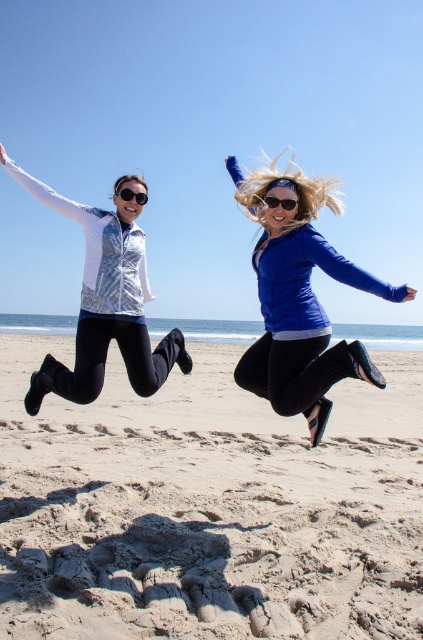
You are a photographer trying to capture the perfect shot of the sandy beach at lower center and the white textured vest at left. Since you want to emphasize the vastness of the beach, which object should you focus on and why?

You should focus on the sandy beach at lower center because it is larger in size than the white textured vest at left, making it better suited to emphasize the vastness of the beach.

Based on the coordinates provided in the image, where is the sandy beach at lower center located?

The sandy beach at lower center is located at point [208,508] in the image.

You are a photographer trying to capture a photo of the white textured vest at left and the black plastic goggles at upper center. Which object should you focus on first if you want to ensure both are in the frame without moving the camera?

The white textured vest at left is located below the black plastic goggles at upper center, so you should focus on the black plastic goggles at upper center first to ensure both are in the frame without moving the camera.